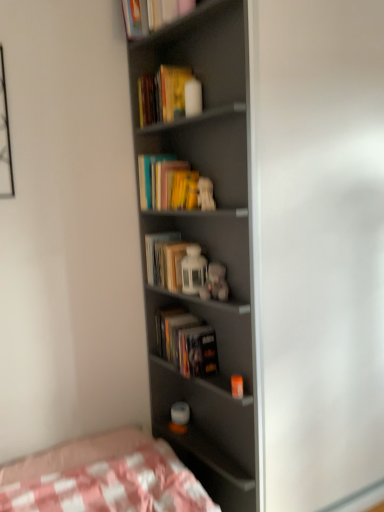
Question: Does hardcover book at center, arranged as the 1th paperback book when ordered from the bottom, lie in front of matte gray bookcase at center?

Choices:
 (A) yes
 (B) no

Answer: (B)

Question: Does hardcover book at center, arranged as the 1th paperback book when ordered from the bottom, have a smaller size compared to matte gray bookcase at center?

Choices:
 (A) yes
 (B) no

Answer: (A)

Question: Is hardcover book at center, arranged as the 1th paperback book when ordered from the bottom, aimed at matte gray bookcase at center?

Choices:
 (A) no
 (B) yes

Answer: (B)

Question: From the image's perspective, is hardcover book at center, arranged as the 1th paperback book when ordered from the bottom, above matte gray bookcase at center?

Choices:
 (A) no
 (B) yes

Answer: (A)

Question: Is hardcover book at center, which appears as the 4th paperback book when viewed from the top, wider than matte gray bookcase at center?

Choices:
 (A) no
 (B) yes

Answer: (A)

Question: Considering the positions of matte gray screen door at center and hardcover book at upper center, which ranks as the 2th book in bottom-to-top order, in the image, is matte gray screen door at center bigger or smaller than hardcover book at upper center, which ranks as the 2th book in bottom-to-top order,?

Choices:
 (A) big
 (B) small

Answer: (A)

Question: In terms of height, does matte gray screen door at center look taller or shorter compared to hardcover book at upper center, the second book from the back?

Choices:
 (A) tall
 (B) short

Answer: (A)

Question: In terms of width, does matte gray screen door at center look wider or thinner when compared to hardcover book at upper center, the 1th book viewed from the top?

Choices:
 (A) wide
 (B) thin

Answer: (A)

Question: From a real-world perspective, relative to hardcover book at upper center, which ranks as the 2th book in bottom-to-top order, is matte gray screen door at center vertically above or below?

Choices:
 (A) above
 (B) below

Answer: (B)

Question: In the image, is hardcover book at center, which appears as the 4th paperback book when viewed from the top, positioned in front of or behind matte gray bookcase at center?

Choices:
 (A) behind
 (B) front

Answer: (A)

Question: Looking at their shapes, would you say hardcover book at center, arranged as the 1th paperback book when ordered from the bottom, is wider or thinner than matte gray bookcase at center?

Choices:
 (A) thin
 (B) wide

Answer: (A)

Question: From the image's perspective, is hardcover book at center, which appears as the 4th paperback book when viewed from the top, above or below matte gray bookcase at center?

Choices:
 (A) above
 (B) below

Answer: (B)

Question: Based on their positions, is hardcover book at center, arranged as the 1th paperback book when ordered from the bottom, located to the left or right of matte gray bookcase at center?

Choices:
 (A) right
 (B) left

Answer: (A)

Question: From the image's perspective, is hardcover books at center, the 3th paperback book from the bottom, above or below hardcover books at center, arranged as the second book when viewed from the front?

Choices:
 (A) below
 (B) above

Answer: (B)

Question: From a real-world perspective, is hardcover books at center, placed as the 2th paperback book when sorted from top to bottom, physically located above or below hardcover books at center, marked as the 1th book in a bottom-to-top arrangement?

Choices:
 (A) below
 (B) above

Answer: (B)